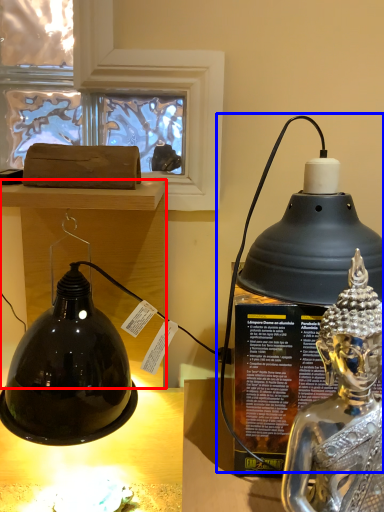
Question: Which of the following is the farthest to the observer, furniture (highlighted by a red box) or oil lamp (highlighted by a blue box)?

Choices:
 (A) furniture
 (B) oil lamp

Answer: (A)